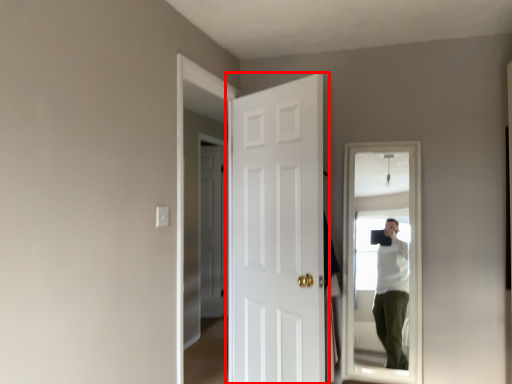
Question: From the image's perspective, where is door (annotated by the red box) located relative to door?

Choices:
 (A) below
 (B) above

Answer: (B)